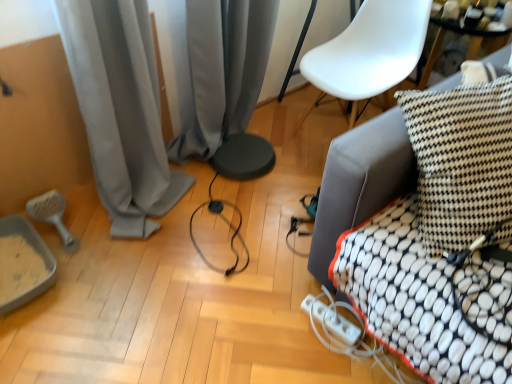
Question: Is black and white checkered pillow at right in front of or behind white plastic extension cord at lower center in the image?

Choices:
 (A) behind
 (B) front

Answer: (B)

Question: From their relative heights in the image, would you say black and white checkered pillow at right is taller or shorter than white plastic extension cord at lower center?

Choices:
 (A) short
 (B) tall

Answer: (B)

Question: Which object is the farthest from the gray fabric curtain at center, the 1th curtain viewed from the right?

Choices:
 (A) white plastic armchair at upper right
 (B) gray fabric curtain at lower left, marked as the 1th curtain in a left-to-right arrangement
 (C) gray matte brush at lower left
 (D) white fabric cushion at right
 (E) white plastic extension cord at lower center

Answer: (E)

Question: Estimate the real-world distances between objects in this image. Which object is closer to the gray fabric curtain at lower left, marked as the 1th curtain in a left-to-right arrangement?

Choices:
 (A) gray matte brush at lower left
 (B) black and white checkered pillow at right
 (C) gray fabric curtain at center, the 1th curtain viewed from the right
 (D) white plastic extension cord at lower center
 (E) white fabric cushion at right

Answer: (C)